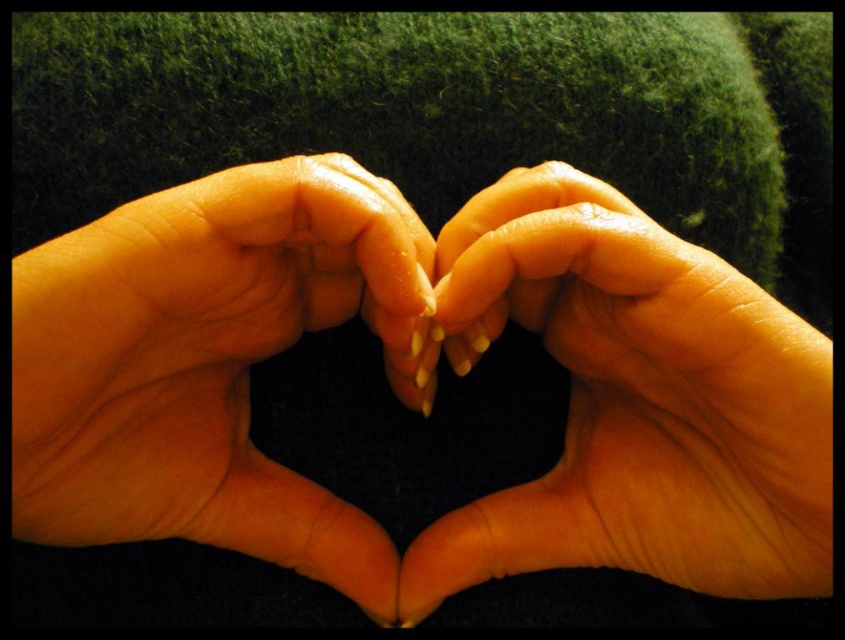
You are taking a photo of two points in the scene. The points are labeled as point (x=372, y=518) and point (x=575, y=301). If you want to focus on the point closer to the camera, which point should you choose?

Point (x=575, y=301) is closer to the camera than point (x=372, y=518), so you should focus on point 0.472, 0.682.

You are a photographer adjusting lighting for a closeup shot of two hands forming a heart. You notice the smooth skin hand at center and the smooth skin hands at center. Which object is positioned higher in the image?

The smooth skin hand at center is positioned higher than the smooth skin hands at center.